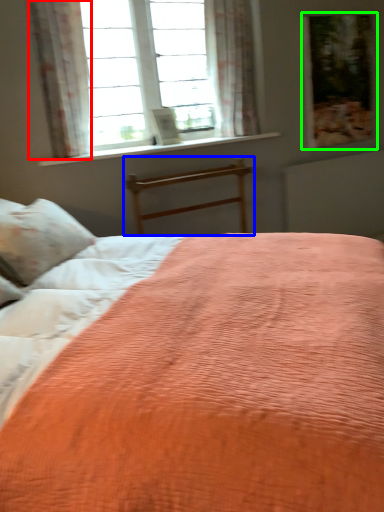
Question: Which is farther away from curtain (highlighted by a red box)? bed frame (highlighted by a blue box) or picture frame (highlighted by a green box)?

Choices:
 (A) bed frame
 (B) picture frame

Answer: (B)